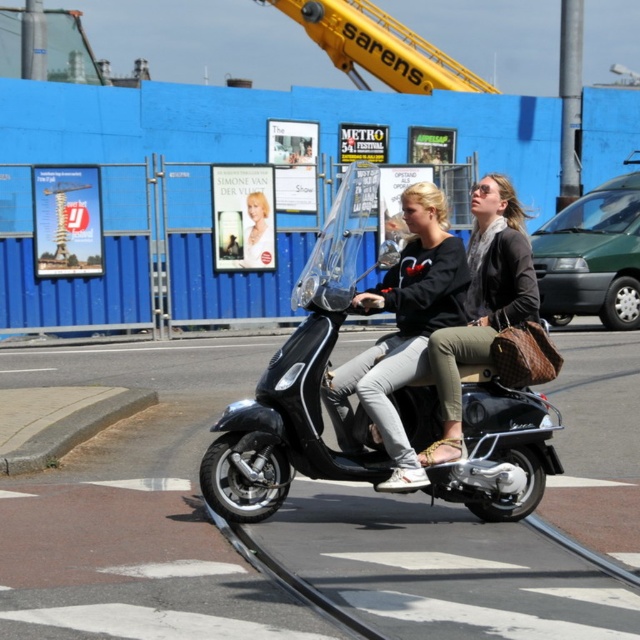
Can you confirm if matte black scooter at center is thinner than blonde hair at center?

Incorrect, matte black scooter at center's width is not less than blonde hair at center's.

What do you see at coordinates (483, 304) in the screenshot? The height and width of the screenshot is (640, 640). I see `matte black scooter at center` at bounding box center [483, 304].

At what (x,y) coordinates should I click in order to perform the action: click on matte black scooter at center. Please return your answer as a coordinate pair (x, y). Looking at the image, I should click on tap(483, 304).

From the picture: Which is below, black matte scooter at center or blonde hair at center?

Positioned lower is black matte scooter at center.

Does black matte scooter at center lie behind blonde hair at center?

No, it is in front of blonde hair at center.

Is point (348, 172) closer to camera compared to point (256, 214)?

Yes.

This screenshot has height=640, width=640. I want to click on black matte scooter at center, so pyautogui.click(x=323, y=369).

Which is behind, point (314, 346) or point (436, 337)?

The point (436, 337) is behind.

Who is more distant from viewer, (344, 465) or (452, 352)?

The point (452, 352) is behind.

Locate an element on the screen. This screenshot has width=640, height=640. black matte scooter at center is located at coordinates tap(323, 369).